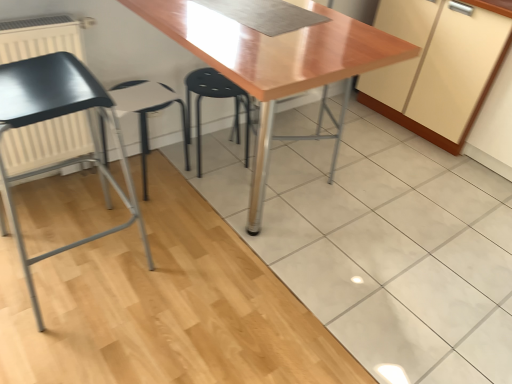
Question: Should I look upward or downward to see glossy wood table at center?

Choices:
 (A) up
 (B) down

Answer: (A)

Question: Is white plastic stool at center surrounded by white matte radiator at left?

Choices:
 (A) no
 (B) yes

Answer: (A)

Question: Does white matte radiator at left come in front of white plastic stool at center?

Choices:
 (A) yes
 (B) no

Answer: (A)

Question: Is white matte radiator at left bigger than white plastic stool at center?

Choices:
 (A) no
 (B) yes

Answer: (A)

Question: Is white matte radiator at left to the left of white plastic stool at center from the viewer's perspective?

Choices:
 (A) no
 (B) yes

Answer: (B)

Question: Is white matte radiator at left facing away from white plastic stool at center?

Choices:
 (A) no
 (B) yes

Answer: (A)

Question: Does white matte radiator at left have a smaller size compared to white plastic stool at center?

Choices:
 (A) no
 (B) yes

Answer: (B)

Question: Is matte black chair at left outside black plastic stool at center?

Choices:
 (A) no
 (B) yes

Answer: (B)

Question: Is matte black chair at left beside black plastic stool at center?

Choices:
 (A) no
 (B) yes

Answer: (A)

Question: Considering the relative positions of matte black chair at left and black plastic stool at center in the image provided, is matte black chair at left in front of black plastic stool at center?

Choices:
 (A) no
 (B) yes

Answer: (B)

Question: Considering the relative sizes of matte black chair at left and black plastic stool at center in the image provided, is matte black chair at left shorter than black plastic stool at center?

Choices:
 (A) no
 (B) yes

Answer: (A)

Question: Is matte black chair at left at the right side of black plastic stool at center?

Choices:
 (A) yes
 (B) no

Answer: (B)

Question: From the image's perspective, would you say matte black chair at left is positioned over black plastic stool at center?

Choices:
 (A) no
 (B) yes

Answer: (A)

Question: Is white matte radiator at left at the right side of black plastic stool at center?

Choices:
 (A) yes
 (B) no

Answer: (B)